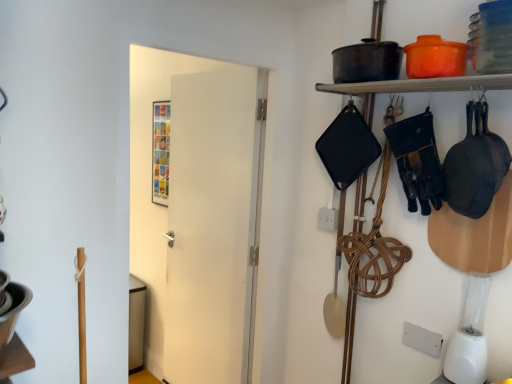
Question: In the image, is white plastic blender at lower right on the left side or the right side of matte black pot at upper right?

Choices:
 (A) left
 (B) right

Answer: (B)

Question: Is white plastic blender at lower right taller or shorter than matte black pot at upper right?

Choices:
 (A) tall
 (B) short

Answer: (A)

Question: Considering the real-world distances, which object is closest to the white matte door at center?

Choices:
 (A) matte black pot at upper right
 (B) white plastic blender at lower right

Answer: (A)

Question: Which object is positioned farthest from the matte black pot at upper right?

Choices:
 (A) white plastic blender at lower right
 (B) white matte door at center

Answer: (B)